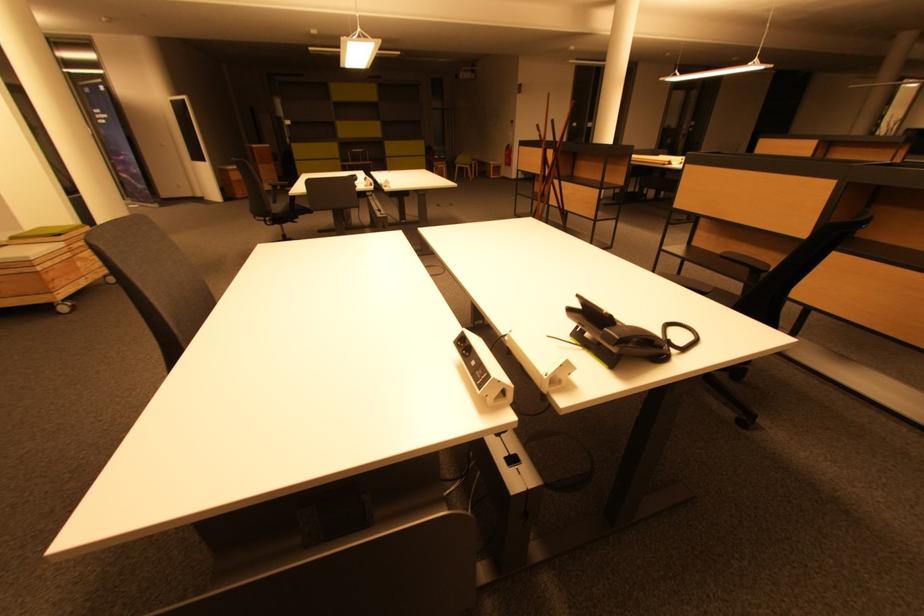
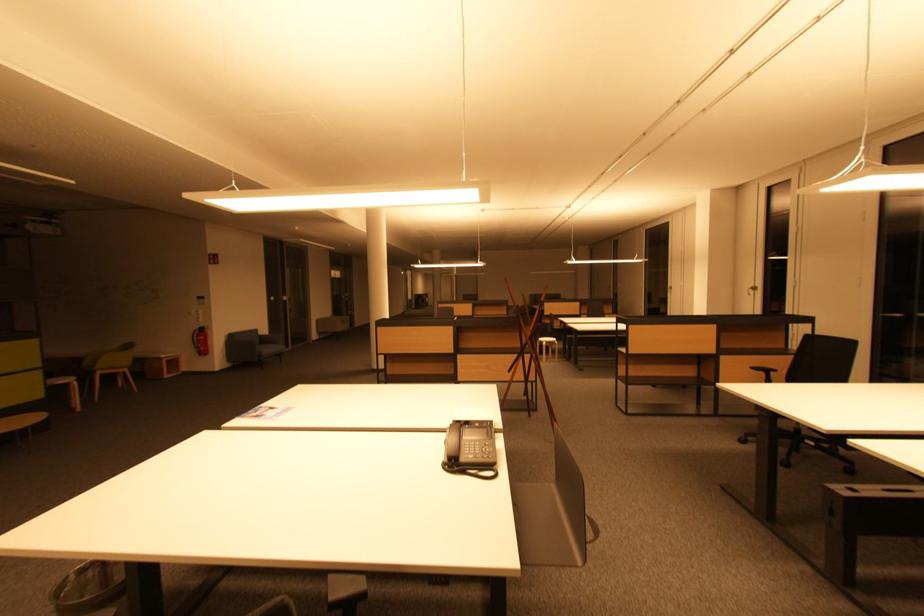
In the second image, find the point that corresponds to point 513,164 in the first image.

(207, 353)